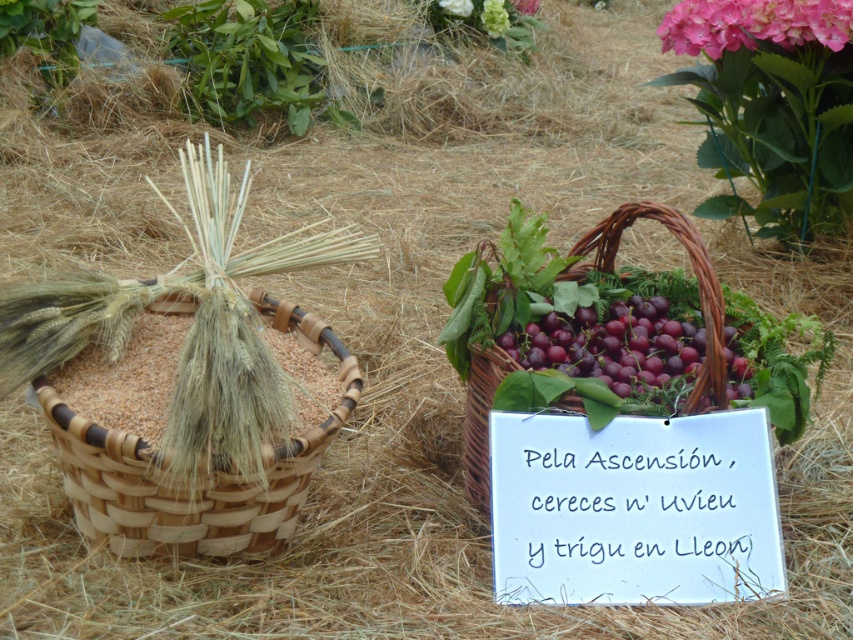
Question: Estimate the real-world distances between objects in this image. Which object is closer to the white paper sign at center?

Choices:
 (A) green leafy plant at upper center
 (B) pink matte hydrangea at upper center
 (C) pink matte hydrangea at upper right

Answer: (C)

Question: Can you confirm if shiny purple grapes at center is thinner than woven brown basket at center?

Choices:
 (A) yes
 (B) no

Answer: (B)

Question: Does natural woven basket at left come behind green leafy plant at upper center?

Choices:
 (A) yes
 (B) no

Answer: (B)

Question: Which of the following is the farthest from the observer?

Choices:
 (A) pink matte hydrangea at upper center
 (B) woven brown basket at center
 (C) white paper sign at center

Answer: (A)

Question: Does pink matte hydrangea at upper right lie behind pink fabric flower at upper center?

Choices:
 (A) no
 (B) yes

Answer: (A)

Question: Which of these objects is positioned farthest from the shiny purple grapes at center?

Choices:
 (A) pink matte hydrangea at upper right
 (B) woven brown basket at center
 (C) natural woven basket at left

Answer: (A)